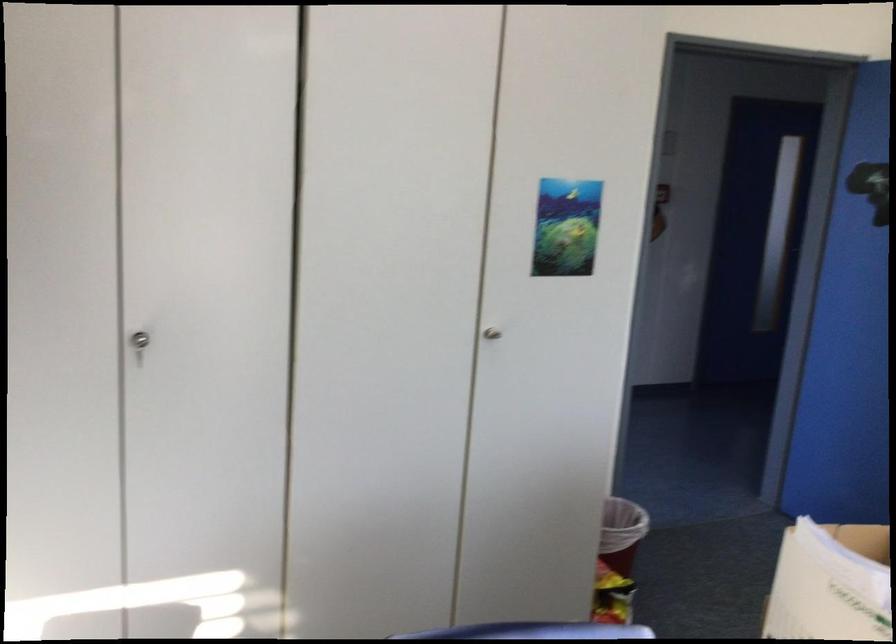
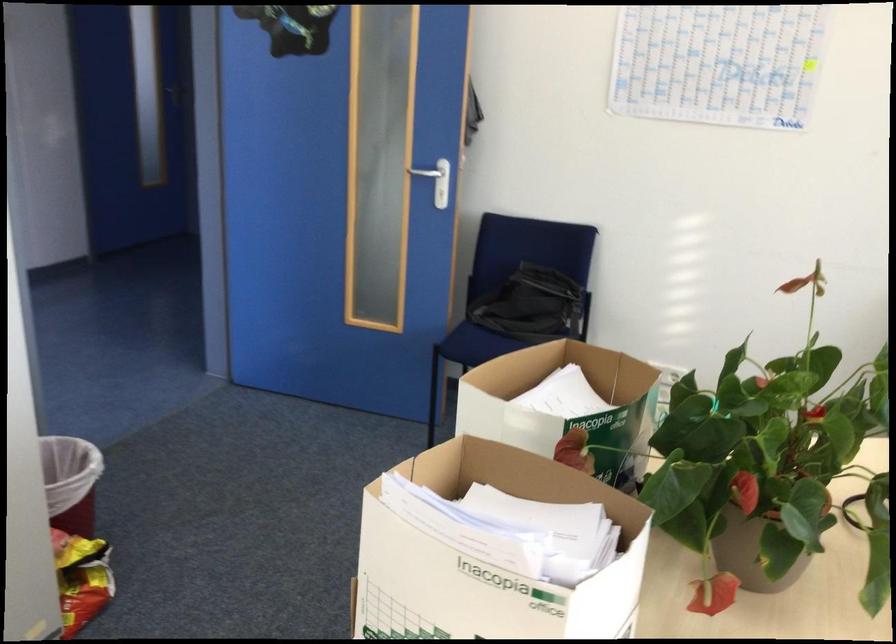
Locate, in the second image, the point that corresponds to pixel 616 513 in the first image.

(71, 482)